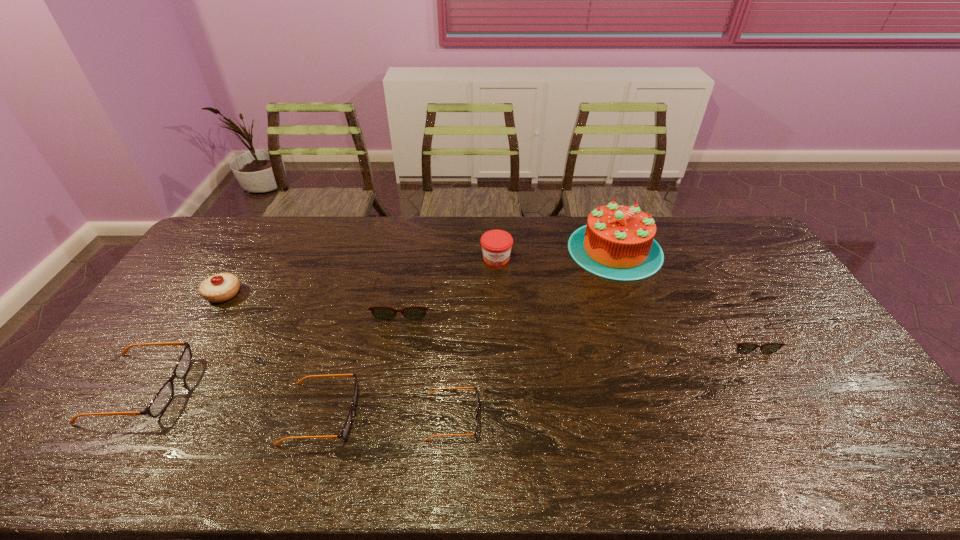
Locate an element on the screen. The width and height of the screenshot is (960, 540). vacant position located 0.210m at the front view of the right brown spectacles is located at coordinates (794, 421).

The width and height of the screenshot is (960, 540). In order to click on vacant area located on the front-facing side of the second spectacles from right to left in this screenshot , I will do `click(519, 417)`.

The width and height of the screenshot is (960, 540). I want to click on cake that is positioned at the far edge, so click(x=617, y=243).

Locate an element on the screen. The width and height of the screenshot is (960, 540). jam that is at the far edge is located at coordinates (496, 244).

The width and height of the screenshot is (960, 540). I want to click on pastry present at the left edge, so click(221, 287).

Where is `spectacles that is at the left edge`? The height and width of the screenshot is (540, 960). spectacles that is at the left edge is located at coordinates (161, 400).

Identify the location of free space at the far edge of the desktop. Image resolution: width=960 pixels, height=540 pixels. (396, 244).

Find the location of a particular element. Image resolution: width=960 pixels, height=540 pixels. vacant region at the near edge of the desktop is located at coordinates (732, 447).

In the image, there is a desktop. Where is `vacant space at the left edge`? The image size is (960, 540). vacant space at the left edge is located at coordinates (170, 319).

This screenshot has height=540, width=960. In the image, there is a desktop. Identify the location of free region at the right edge. (841, 367).